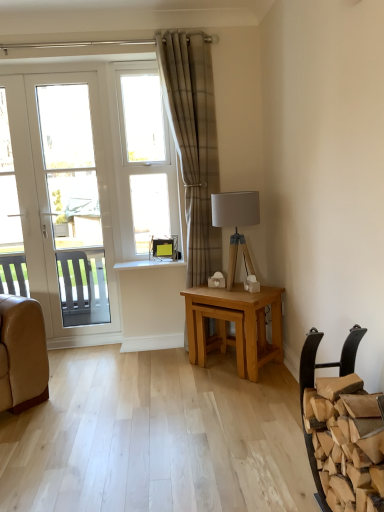
Describe the element at coordinates (145, 159) in the screenshot. The image size is (384, 512). I see `white plastic window at center` at that location.

What do you see at coordinates (326, 362) in the screenshot?
I see `brown leather chair at lower right` at bounding box center [326, 362].

The width and height of the screenshot is (384, 512). Identify the location of brown leather chair at lower right. (326, 362).

What is the approximate height of matte gray fabric lampshade at right?

It is 24.03 inches.

This screenshot has width=384, height=512. What do you see at coordinates (236, 223) in the screenshot?
I see `matte gray fabric lampshade at right` at bounding box center [236, 223].

Identify the location of white plastic window at center. The height and width of the screenshot is (512, 384). (145, 159).

Is matte gray fabric lampshade at right not close to white glossy door at left?

matte gray fabric lampshade at right is far away from white glossy door at left.

From a real-world perspective, between matte gray fabric lampshade at right and white glossy door at left, who is vertically higher?

From a 3D spatial view, white glossy door at left is above.

Is matte gray fabric lampshade at right positioned in front of white glossy door at left?

Yes, matte gray fabric lampshade at right is in front of white glossy door at left.

Consider the image. Which is correct: plaid fabric curtain at center is inside brown leather chair at lower right, or outside of it?

plaid fabric curtain at center exists outside the volume of brown leather chair at lower right.

At what (x,y) coordinates should I click in order to perform the action: click on chair below the plaid fabric curtain at center (from the image's perspective). Please return your answer as a coordinate pair (x, y). The width and height of the screenshot is (384, 512). Looking at the image, I should click on (326, 362).

Which object is closer to the camera taking this photo, plaid fabric curtain at center or brown leather chair at lower right?

Positioned in front is brown leather chair at lower right.

Is plaid fabric curtain at center wider or thinner than brown leather chair at lower right?

plaid fabric curtain at center is thinner than brown leather chair at lower right.

Does white glossy door at left appear on the right side of plaid fabric curtain at center?

No.

Considering the sizes of objects white glossy door at left and plaid fabric curtain at center in the image provided, who is thinner, white glossy door at left or plaid fabric curtain at center?

white glossy door at left is thinner.

Who is taller, white glossy door at left or plaid fabric curtain at center?

Standing taller between the two is plaid fabric curtain at center.

Considering the sizes of objects white glossy door at left and white plastic window at center in the image provided, who is thinner, white glossy door at left or white plastic window at center?

With smaller width is white plastic window at center.

Considering the sizes of objects white glossy door at left and white plastic window at center in the image provided, who is bigger, white glossy door at left or white plastic window at center?

Bigger between the two is white glossy door at left.

Considering the positions of points (39, 192) and (135, 236), is point (39, 192) farther from camera compared to point (135, 236)?

No, (39, 192) is in front of (135, 236).

Where is `window above the white glossy door at left (from the image's perspective)`? The width and height of the screenshot is (384, 512). window above the white glossy door at left (from the image's perspective) is located at coordinates (145, 159).

Is light oak wooden table at center oriented away from white plastic window at center?

light oak wooden table at center does not have its back to white plastic window at center.

Is light oak wooden table at center to the right of white plastic window at center from the viewer's perspective?

Yes, light oak wooden table at center is to the right of white plastic window at center.

Where is `window located on the left of light oak wooden table at center`? window located on the left of light oak wooden table at center is located at coordinates (x=145, y=159).

Is light oak wooden table at center positioned far away from white plastic window at center?

No, there isn't a large distance between light oak wooden table at center and white plastic window at center.

Does point (308, 449) lie in front of point (42, 200)?

That is True.

Considering the sizes of objects brown leather chair at lower right and white glossy door at left in the image provided, who is smaller, brown leather chair at lower right or white glossy door at left?

brown leather chair at lower right is smaller.

From the picture: From a real-world perspective, which is physically above, white plastic window at center or matte gray fabric lampshade at right?

white plastic window at center is physically above.

Does white plastic window at center have a lesser height compared to matte gray fabric lampshade at right?

No, white plastic window at center is not shorter than matte gray fabric lampshade at right.

Considering the relative sizes of white plastic window at center and matte gray fabric lampshade at right in the image provided, is white plastic window at center bigger than matte gray fabric lampshade at right?

No, white plastic window at center is not bigger than matte gray fabric lampshade at right.

Is white plastic window at center aimed at matte gray fabric lampshade at right?

No, white plastic window at center is not aimed at matte gray fabric lampshade at right.

In order to click on lamp that appears below the white glossy door at left (from a real-world perspective) in this screenshot , I will do `click(236, 223)`.

Where is `curtain above the brown leather chair at lower right (from a real-world perspective)`? The height and width of the screenshot is (512, 384). curtain above the brown leather chair at lower right (from a real-world perspective) is located at coordinates (193, 142).

Looking at the image, which one is located further to plaid fabric curtain at center, brown leather chair at lower right or light oak wooden table at center?

Based on the image, brown leather chair at lower right appears to be further to plaid fabric curtain at center.

Looking at the image, which one is located closer to white plastic window at center, brown leather chair at lower right or matte gray fabric lampshade at right?

matte gray fabric lampshade at right is positioned closer to the anchor white plastic window at center.

Looking at the image, which one is located further to white plastic window at center, matte gray fabric lampshade at right or plaid fabric curtain at center?

matte gray fabric lampshade at right is positioned further to the anchor white plastic window at center.

Estimate the real-world distances between objects in this image. Which object is further from white glossy door at left, matte gray fabric lampshade at right or brown leather chair at lower right?

brown leather chair at lower right.

Consider the image. Based on their spatial positions, is white plastic window at center or light oak wooden table at center further from white glossy door at left?

light oak wooden table at center.

Estimate the real-world distances between objects in this image. Which object is further from matte gray fabric lampshade at right, plaid fabric curtain at center or brown leather chair at lower right?

Based on the image, brown leather chair at lower right appears to be further to matte gray fabric lampshade at right.

In the scene shown: Estimate the real-world distances between objects in this image. Which object is closer to white glossy door at left, light oak wooden table at center or matte gray fabric lampshade at right?

light oak wooden table at center.

Looking at the image, which one is located further to matte gray fabric lampshade at right, light oak wooden table at center or plaid fabric curtain at center?

Based on the image, plaid fabric curtain at center appears to be further to matte gray fabric lampshade at right.

Find the location of a particular element. This screenshot has height=512, width=384. window situated between white glossy door at left and light oak wooden table at center from left to right is located at coordinates (145, 159).

Where is `table between brown leather chair at lower right and white plastic window at center from front to back`? The image size is (384, 512). table between brown leather chair at lower right and white plastic window at center from front to back is located at coordinates (235, 325).

This screenshot has width=384, height=512. I want to click on lamp between white plastic window at center and light oak wooden table at center vertically, so click(x=236, y=223).

You are a GUI agent. You are given a task and a screenshot of the screen. Output one action in this format:
    pyautogui.click(x=<x>, y=<y>)
    Task: Click on the curtain between brown leather chair at lower right and white glossy door at left in the front-back direction
    The height and width of the screenshot is (512, 384).
    Given the screenshot: What is the action you would take?
    pyautogui.click(x=193, y=142)